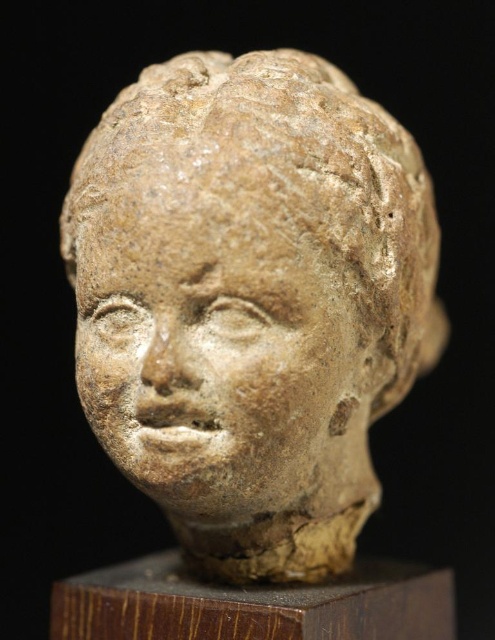
Can you confirm if brown clay head at center is wider than earthy clay face at center?

Yes.

Does brown clay head at center appear on the right side of earthy clay face at center?

Indeed, brown clay head at center is positioned on the right side of earthy clay face at center.

Is point (314, 259) closer to viewer compared to point (154, 284)?

No, it is not.

Identify the location of brown clay head at center. The width and height of the screenshot is (495, 640). (250, 301).